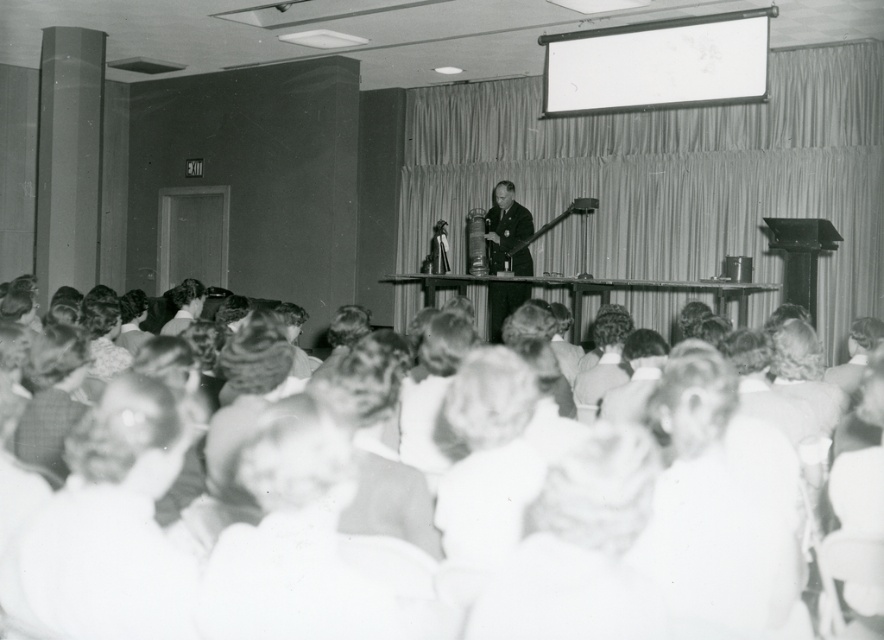
You are standing in the conference hall and need to reach the point marked at coordinates (55, 602). If your walking distance is limited to 2 meters, can you reach that point without moving?

The point marked at coordinates (55, 602) is 1.94 meters away from you, which is within your 2 meter limit. Yes, you can reach it without moving further than allowed.